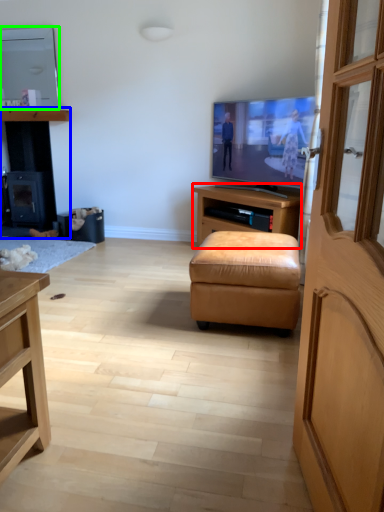
Question: Which object is positioned farthest from cabinetry (highlighted by a red box)? Select from dresser (highlighted by a blue box) and television (highlighted by a green box).

Choices:
 (A) dresser
 (B) television

Answer: (A)